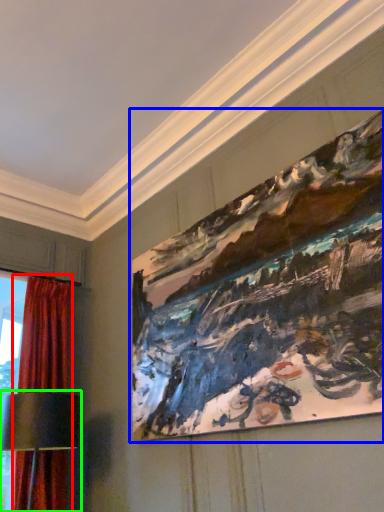
Question: Estimate the real-world distances between objects in this image. Which object is closer to curtain (highlighted by a red box), picture frame (highlighted by a blue box) or table lamp (highlighted by a green box)?

Choices:
 (A) picture frame
 (B) table lamp

Answer: (B)